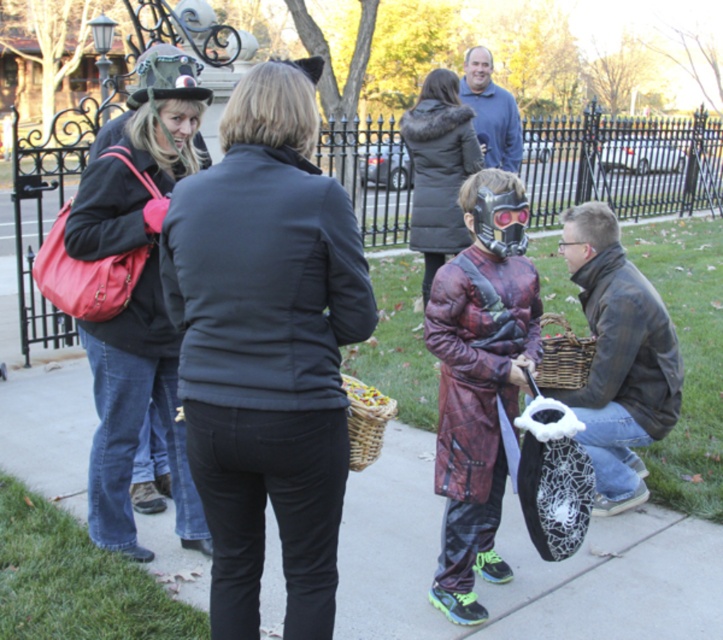
Looking at this image, between matte black jacket at center and red plaid coat at center, which one is positioned lower?

red plaid coat at center is below.

Does matte black jacket at center have a smaller size compared to red plaid coat at center?

No, matte black jacket at center is not smaller than red plaid coat at center.

Does point (260, 156) lie in front of point (487, 333)?

That is True.

Find the location of `matte black jacket at center`. matte black jacket at center is located at coordinates (265, 346).

Does leather jacket at lower right lie behind black fur-trimmed coat at center?

That is False.

I want to click on leather jacket at lower right, so click(623, 369).

Who is more forward, (x=669, y=412) or (x=437, y=116)?

Point (x=669, y=412) is in front.

The width and height of the screenshot is (723, 640). What are the coordinates of `leather jacket at lower right` in the screenshot? It's located at (623, 369).

Find the location of a particular element. This screenshot has height=640, width=723. matte black jacket at left is located at coordinates (128, 362).